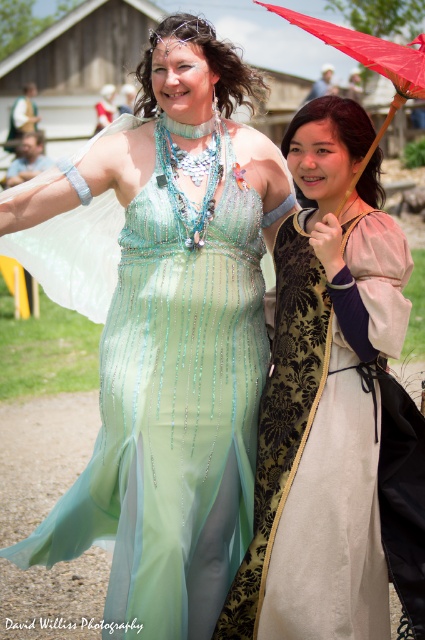
Question: Does light green sheer dress at center have a larger size compared to velvet gold dress at center?

Choices:
 (A) no
 (B) yes

Answer: (B)

Question: Which point appears farthest from the camera in this image?

Choices:
 (A) (249, 467)
 (B) (297, 358)
 (C) (396, 65)

Answer: (A)

Question: Does light green sheer dress at center appear under red fabric umbrella at upper right?

Choices:
 (A) yes
 (B) no

Answer: (A)

Question: Is light green sheer dress at center in front of velvet gold dress at center?

Choices:
 (A) no
 (B) yes

Answer: (A)

Question: Which object is farther from the camera taking this photo?

Choices:
 (A) velvet gold dress at center
 (B) red fabric umbrella at upper right
 (C) light green sheer dress at center

Answer: (C)

Question: Which of the following is the closest to the observer?

Choices:
 (A) (261, 428)
 (B) (339, 29)
 (C) (47, 525)

Answer: (B)